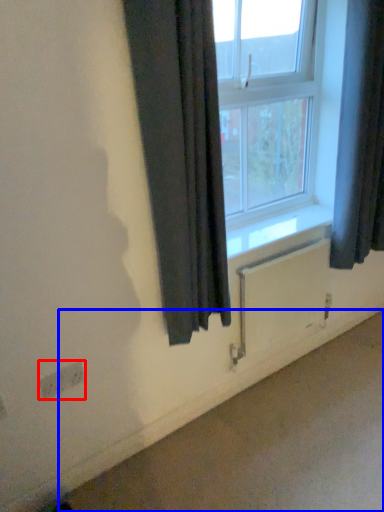
Question: Among these objects, which one is nearest to the camera, electric outlet (highlighted by a red box) or concrete (highlighted by a blue box)?

Choices:
 (A) electric outlet
 (B) concrete

Answer: (B)